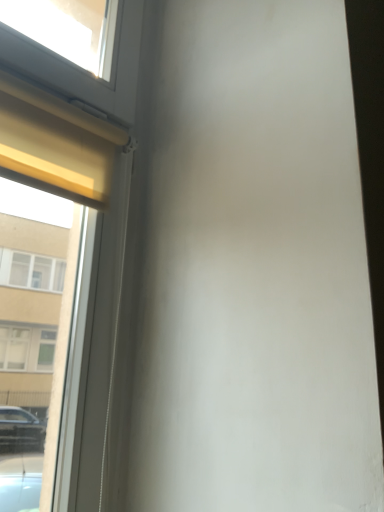
I want to click on white matte window at upper left, so 61,241.

Describe the element at coordinates (61, 241) in the screenshot. I see `white matte window at upper left` at that location.

This screenshot has height=512, width=384. What are the coordinates of `white matte window at upper left` in the screenshot? It's located at (61, 241).